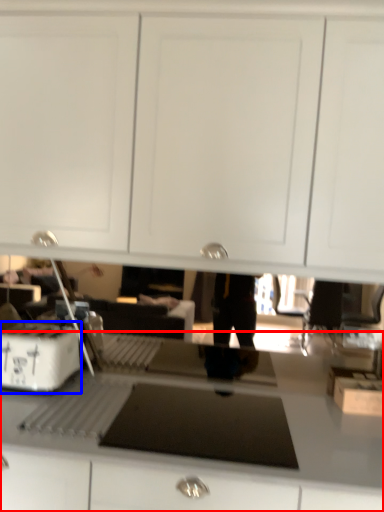
Question: Among these objects, which one is nearest to the camera, countertop (highlighted by a red box) or home appliance (highlighted by a blue box)?

Choices:
 (A) countertop
 (B) home appliance

Answer: (A)